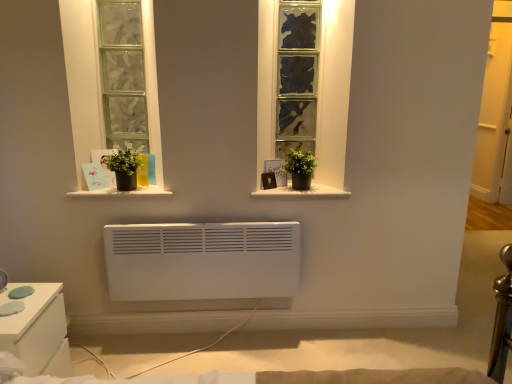
Question: Is the position of white glossy nightstand at lower left less distant than that of matte black pot at center, which is counted as the 1th window sill, starting from the left?

Choices:
 (A) yes
 (B) no

Answer: (A)

Question: Could matte black pot at center, acting as the 2th window sill starting from the right, be considered to be inside white glossy nightstand at lower left?

Choices:
 (A) yes
 (B) no

Answer: (B)

Question: Is white glossy nightstand at lower left turned away from matte black pot at center, which is counted as the 1th window sill, starting from the left?

Choices:
 (A) no
 (B) yes

Answer: (A)

Question: Would you say white glossy nightstand at lower left is a long distance from matte black pot at center, acting as the 2th window sill starting from the right?

Choices:
 (A) no
 (B) yes

Answer: (A)

Question: From a real-world perspective, is white glossy nightstand at lower left located beneath matte black pot at center, which is counted as the 1th window sill, starting from the left?

Choices:
 (A) yes
 (B) no

Answer: (A)

Question: Is white glossy nightstand at lower left touching matte black pot at center, which is counted as the 1th window sill, starting from the left?

Choices:
 (A) no
 (B) yes

Answer: (A)

Question: Would you say matte black pot at center, acting as the 2th window sill starting from the right, contains green matte plant pot at center, placed as the second houseplant when sorted from left to right?

Choices:
 (A) yes
 (B) no

Answer: (B)

Question: From the image's perspective, is matte black pot at center, which is counted as the 1th window sill, starting from the left, below green matte plant pot at center, placed as the second houseplant when sorted from left to right?

Choices:
 (A) no
 (B) yes

Answer: (B)

Question: Is matte black pot at center, which is counted as the 1th window sill, starting from the left, positioned in front of green matte plant pot at center, which is the first houseplant from right to left?

Choices:
 (A) no
 (B) yes

Answer: (B)

Question: Considering the relative sizes of matte black pot at center, acting as the 2th window sill starting from the right, and green matte plant pot at center, placed as the second houseplant when sorted from left to right, in the image provided, is matte black pot at center, acting as the 2th window sill starting from the right, bigger than green matte plant pot at center, placed as the second houseplant when sorted from left to right,?

Choices:
 (A) no
 (B) yes

Answer: (A)

Question: From the image's perspective, is matte black pot at center, which is counted as the 1th window sill, starting from the left, over green matte plant pot at center, which is the first houseplant from right to left?

Choices:
 (A) no
 (B) yes

Answer: (A)

Question: Is green matte plant pot at center, which is the first houseplant from right to left, at the back of matte black pot at center, which is counted as the 1th window sill, starting from the left?

Choices:
 (A) yes
 (B) no

Answer: (B)

Question: Is green matte plant pot at center, placed as the second houseplant when sorted from left to right, completely or partially inside textured glass window at center?

Choices:
 (A) yes
 (B) no

Answer: (B)